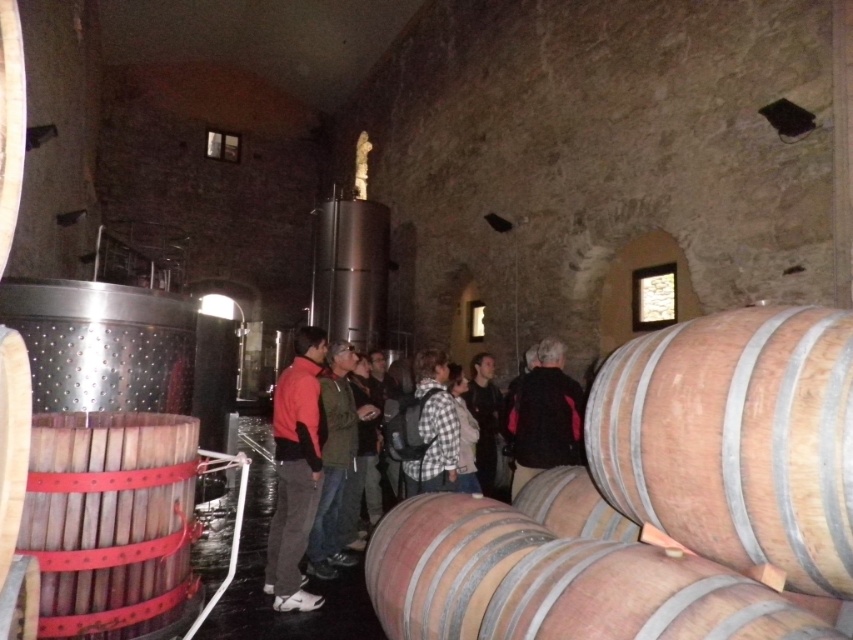
You are standing in the winery and need to place a new barrel between the two points labeled point (737,628) and point (341,444). Which point should the barrel be closer to in order to be nearer to the viewer?

The barrel should be placed closer to point (737,628) because it is closer to the viewer than point (341,444).

You are a tour guide leading a group through the winery. You want to ensure everyone can safely walk around the natural wood barrel at lower right. Considering the space between you and the barrel, is there enough room for a person to pass comfortably?

The distance between the natural wood barrel at lower right and the viewer is 1.57 meters. This is sufficient space for a person to comfortably pass by the barrel, as typical personal space requirements are around 1 meter.